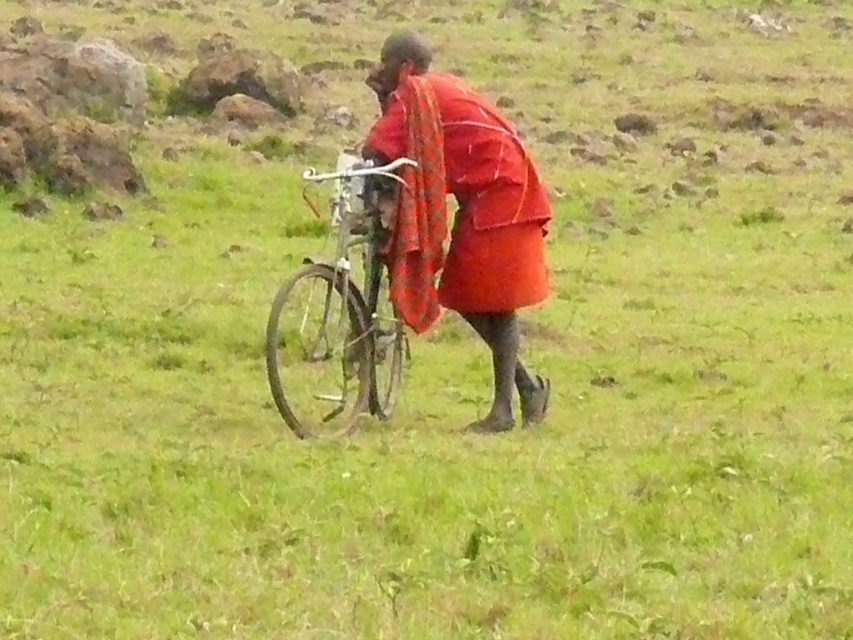
You are a traveler who needs to secure your silver metallic bicycle at center for a short rest. The red woven cloth at center is currently covering it. Can you easily access the bicycle without removing the cloth?

The red woven cloth at center is positioned over the silver metallic bicycle at center, so you would need to remove the cloth to access the bicycle.

You are a photographer trying to capture the red woven cloth at center in your shot. Based on the coordinates provided, where should you position your camera to ensure the cloth is centered in the frame?

The red woven cloth at center is located at coordinates point (x=461, y=216), so positioning the camera to aim directly at those coordinates will center the cloth in the frame.